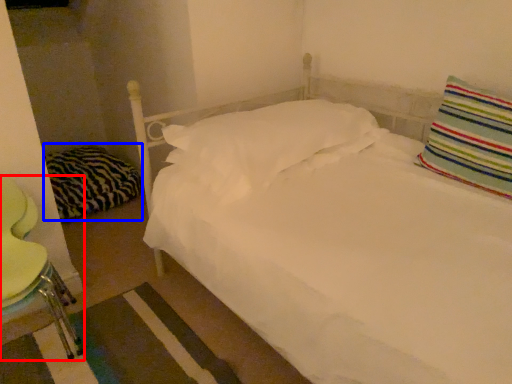
Question: Which point is further to the camera, swivel chair (highlighted by a red box) or pillow (highlighted by a blue box)?

Choices:
 (A) swivel chair
 (B) pillow

Answer: (B)